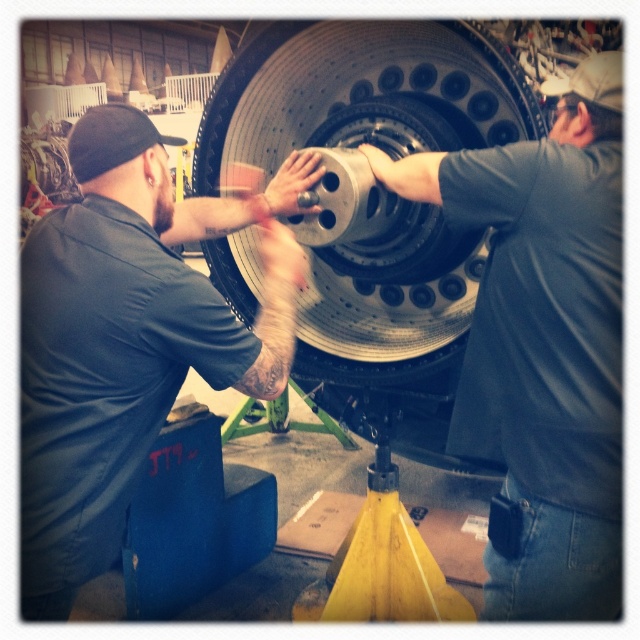
Question: Can you confirm if matte black shirt at left is positioned above metallic silver tire at center?

Choices:
 (A) yes
 (B) no

Answer: (B)

Question: Which point appears closest to the camera in this image?

Choices:
 (A) (122, 484)
 (B) (534, 586)

Answer: (B)

Question: Can you confirm if matte black shirt at left is positioned to the left of matte black tire at center?

Choices:
 (A) no
 (B) yes

Answer: (B)

Question: Can you confirm if matte black shirt at left is positioned to the left of matte black tire at center?

Choices:
 (A) no
 (B) yes

Answer: (B)

Question: Which point is farther to the camera?

Choices:
 (A) metallic silver tire at center
 (B) matte black shirt at left
 (C) matte black tire at center

Answer: (A)

Question: Which of these objects is positioned closest to the matte black tire at center?

Choices:
 (A) matte black shirt at left
 (B) metallic silver tire at center

Answer: (B)